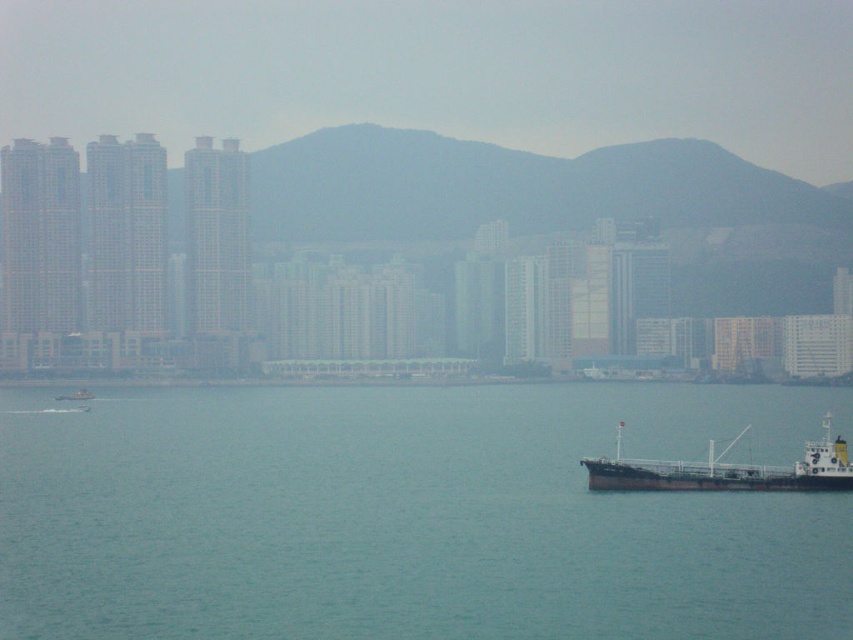
Who is positioned more to the right, clear blue water at center or metallic gray boat at lower left?

clear blue water at center is more to the right.

Does clear blue water at center appear on the left side of metallic gray boat at lower left?

Incorrect, clear blue water at center is not on the left side of metallic gray boat at lower left.

Between point (537, 579) and point (62, 397), which one is positioned behind?

The point (62, 397) is more distant.

Find the location of a particular element. clear blue water at center is located at coordinates (410, 515).

Which is below, brown matte cargo ship at lower right or metallic gray boat at lower left?

brown matte cargo ship at lower right is below.

Is point (618, 435) behind point (54, 400)?

No, (618, 435) is closer to viewer.

This screenshot has height=640, width=853. Find the location of `brown matte cargo ship at lower right`. brown matte cargo ship at lower right is located at coordinates (726, 470).

The width and height of the screenshot is (853, 640). What do you see at coordinates (410, 515) in the screenshot?
I see `clear blue water at center` at bounding box center [410, 515].

Between clear blue water at center and brown matte cargo ship at lower right, which one has more height?

Standing taller between the two is clear blue water at center.

Identify the location of clear blue water at center. click(x=410, y=515).

You are a GUI agent. You are given a task and a screenshot of the screen. Output one action in this format:
    pyautogui.click(x=<x>, y=<y>)
    Task: Click on the clear blue water at center
    The image size is (853, 640).
    Given the screenshot: What is the action you would take?
    pyautogui.click(x=410, y=515)